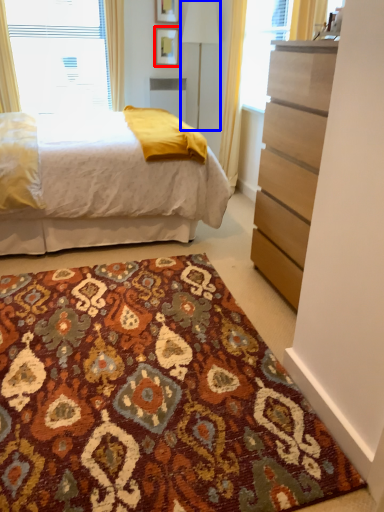
Question: Which object appears farthest to the camera in this image, picture frame (highlighted by a red box) or table lamp (highlighted by a blue box)?

Choices:
 (A) picture frame
 (B) table lamp

Answer: (A)